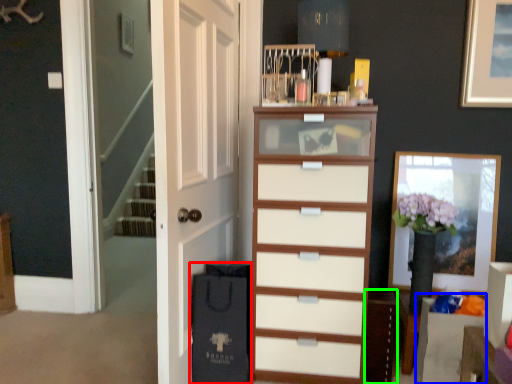
Question: Which is nearer to the shopping bag (highlighted by a red box)? vanity (highlighted by a blue box) or cabinetry (highlighted by a green box).

Choices:
 (A) vanity
 (B) cabinetry

Answer: (B)